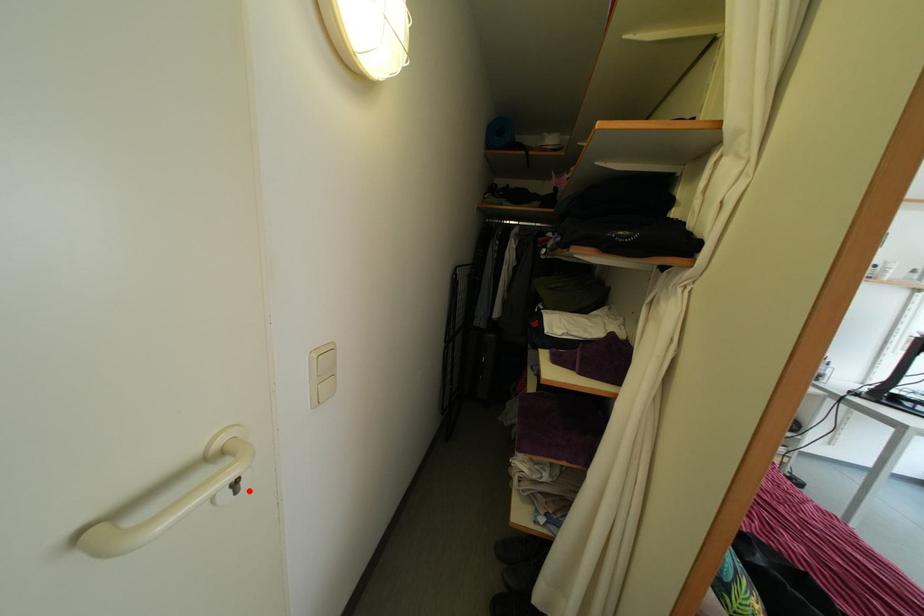
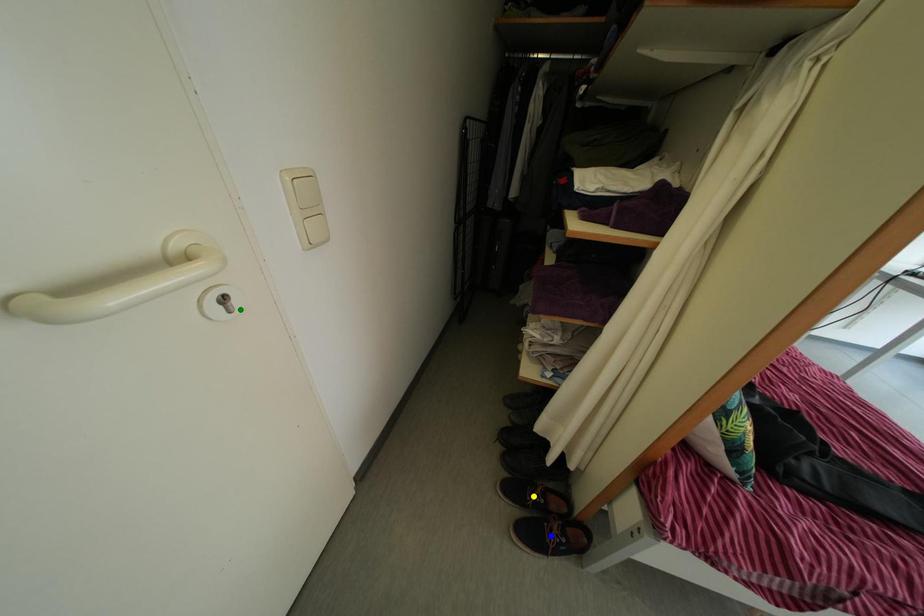
Question: I am providing you with two images of the same scene from different viewpoints. A red point is marked on the first image. You are given multiple points on the second image. Can you choose the point in image 2 that corresponds to the point in image 1?

Choices:
 (A) green point
 (B) yellow point
 (C) blue point

Answer: (A)